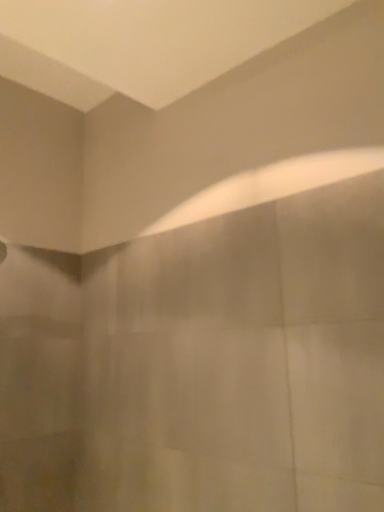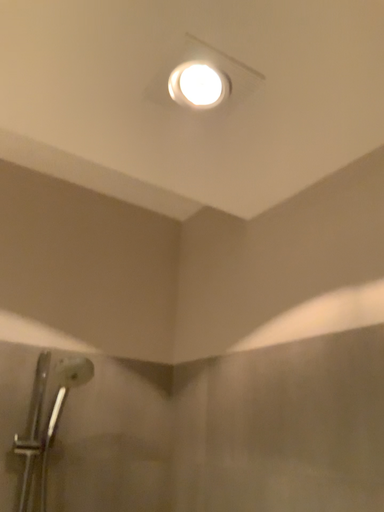
Question: Which way did the camera rotate in the video?

Choices:
 (A) rotated upward
 (B) rotated downward

Answer: (A)